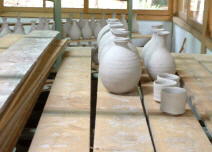
At what (x,y) coordinates should I click in order to perform the action: click on medium vases. Please return your answer as a coordinate pair (x, y). This screenshot has width=212, height=152. Looking at the image, I should click on (156, 65), (149, 51), (147, 43).